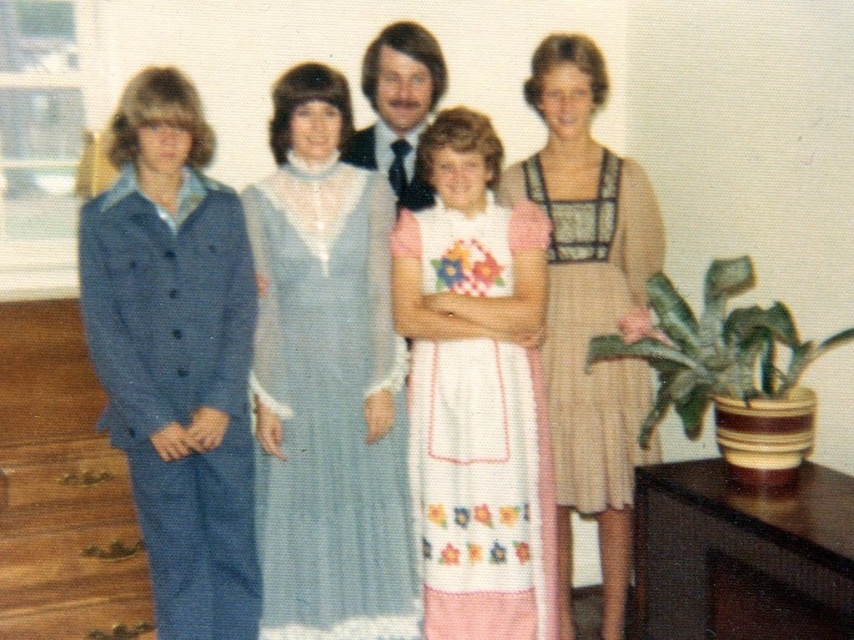
Looking at this image, does blue denim suit at left lie behind beige textured dress at center?

No, blue denim suit at left is in front of beige textured dress at center.

Is blue denim suit at left bigger than beige textured dress at center?

Correct, blue denim suit at left is larger in size than beige textured dress at center.

Find the location of a particular element. blue denim suit at left is located at coordinates (589, 307).

At what (x,y) coordinates should I click in order to perform the action: click on blue denim suit at left. Please return your answer as a coordinate pair (x, y). This screenshot has height=640, width=854. Looking at the image, I should click on (589, 307).

Does blue denim suit at left come in front of smooth brown hair at center?

That is True.

Does blue denim suit at left have a larger size compared to smooth brown hair at center?

Correct, blue denim suit at left is larger in size than smooth brown hair at center.

You are a GUI agent. You are given a task and a screenshot of the screen. Output one action in this format:
    pyautogui.click(x=<x>, y=<y>)
    Task: Click on the blue denim suit at left
    
    Given the screenshot: What is the action you would take?
    pyautogui.click(x=589, y=307)

Can you confirm if beige textured dress at center is positioned to the left of smooth brown hair at center?

No, beige textured dress at center is not to the left of smooth brown hair at center.

Is point (547, 196) closer to camera compared to point (407, 84)?

Yes, it is.

Between point (563, 500) and point (410, 140), which one is positioned behind?

The point (410, 140) is more distant.

Image resolution: width=854 pixels, height=640 pixels. I want to click on beige textured dress at center, so [594, 326].